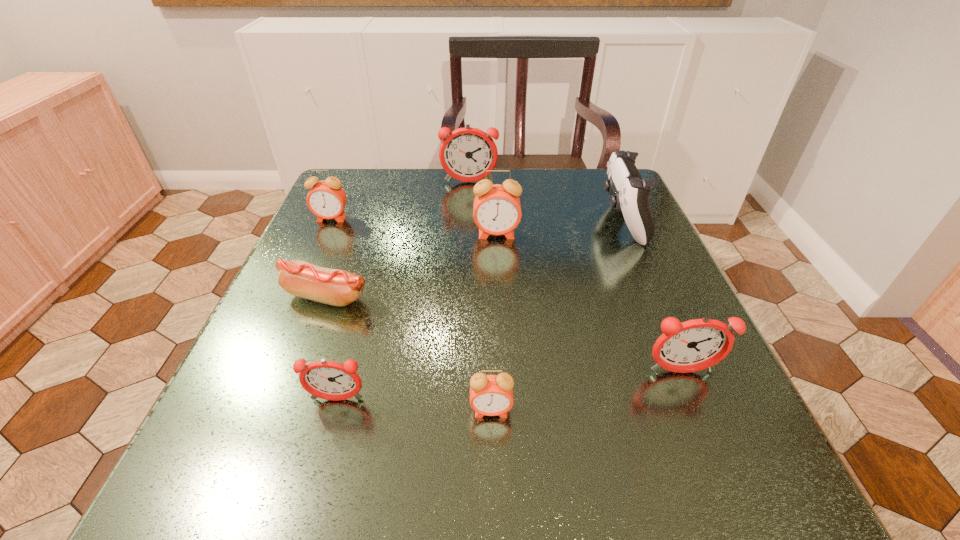
Locate an element on the screen. unoccupied position between the farthest reddish-pink alarm clock and the leftmost pink alarm clock is located at coordinates 400,200.

Image resolution: width=960 pixels, height=540 pixels. I want to click on free point between the leftmost alarm clock and the nearest pink alarm clock, so click(x=411, y=315).

At what (x,y) coordinates should I click in order to perform the action: click on free point between the control and the smallest reddish-pink alarm clock. Please return your answer as a coordinate pair (x, y). Looking at the image, I should click on (479, 310).

This screenshot has height=540, width=960. I want to click on vacant area that lies between the brown sausage and the biggest reddish-pink alarm clock, so click(398, 240).

Locate an element on the screen. vacant area that lies between the biggest pink alarm clock and the nearest reddish-pink alarm clock is located at coordinates (417, 317).

Where is `vacant area between the second farthest alarm clock and the fifth alarm clock from right to left`? The height and width of the screenshot is (540, 960). vacant area between the second farthest alarm clock and the fifth alarm clock from right to left is located at coordinates [x=334, y=309].

Identify the location of object that ranks as the fifth closest to the control. (299, 278).

Identify which object is the fifth nearest to the second reddish-pink alarm clock from right to left. Please provide its 2D coordinates. Your answer should be formatted as a tuple, i.e. [(x, y)], where the tuple contains the x and y coordinates of a point satisfying the conditions above.

[(694, 345)]

Where is `alarm clock that can be found as the closest to the leftmost reddish-pink alarm clock`? alarm clock that can be found as the closest to the leftmost reddish-pink alarm clock is located at coordinates (491, 395).

Where is `alarm clock object that ranks as the second closest to the control`? The height and width of the screenshot is (540, 960). alarm clock object that ranks as the second closest to the control is located at coordinates (465, 154).